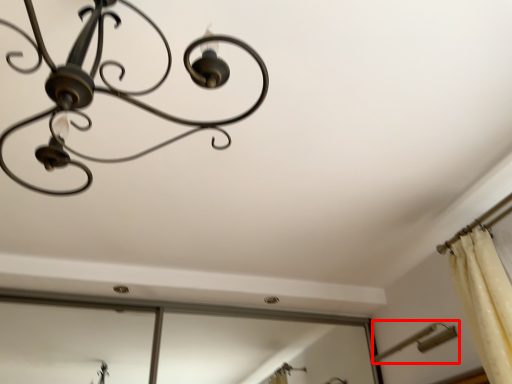
Question: From the image's perspective, what is the correct spatial relationship of lamp (annotated by the red box) in relation to lamp?

Choices:
 (A) below
 (B) above

Answer: (A)